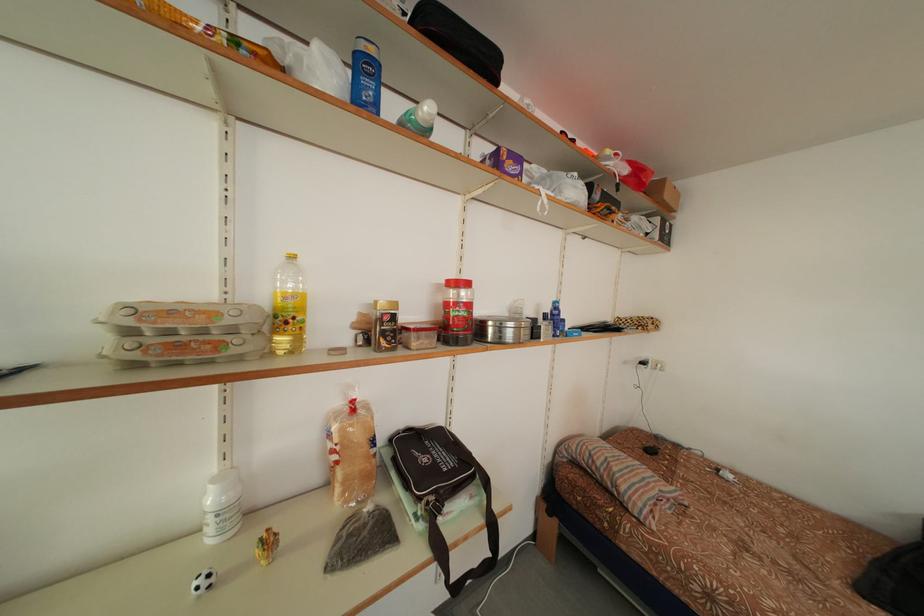
Where is `white bottle lid`? The image size is (924, 616). white bottle lid is located at coordinates (426, 111).